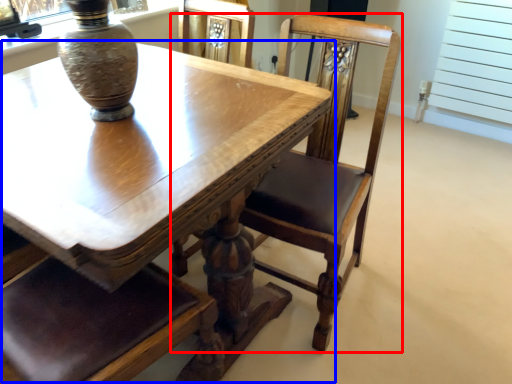
Question: Which of the following is the closest to the observer, chair (highlighted by a red box) or table (highlighted by a blue box)?

Choices:
 (A) chair
 (B) table

Answer: (B)